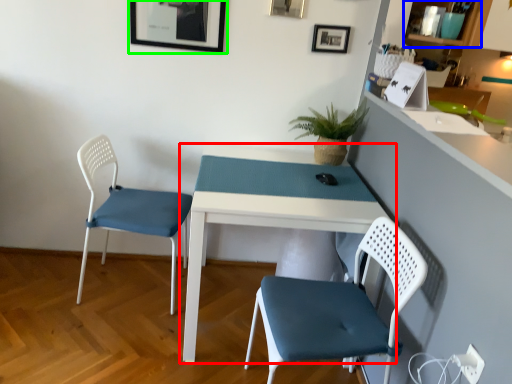
Question: Which is farther away from table (highlighted by a red box)? shelf (highlighted by a blue box) or picture frame (highlighted by a green box)?

Choices:
 (A) shelf
 (B) picture frame

Answer: (A)